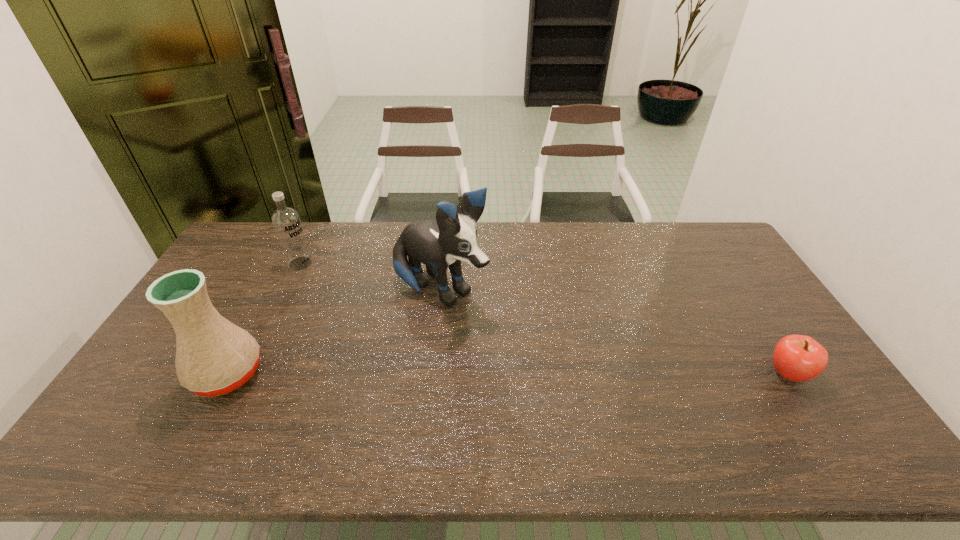
I want to click on object that is at the near right corner, so click(x=798, y=358).

Where is `free space at the far edge`? This screenshot has height=540, width=960. free space at the far edge is located at coordinates click(x=658, y=246).

Where is `free location at the near edge of the desktop`? The height and width of the screenshot is (540, 960). free location at the near edge of the desktop is located at coordinates (439, 420).

Identify the location of vacant point at the left edge. (165, 386).

Identify the location of vacant space at the near left corner. (149, 420).

In the image, there is a desktop. Where is `free space at the near right corner`? free space at the near right corner is located at coordinates (819, 410).

Where is `empty location between the vodka and the rightmost object`? empty location between the vodka and the rightmost object is located at coordinates point(544,319).

At what (x,y) coordinates should I click in order to perform the action: click on free space between the vodka and the third object from left to right. Please return your answer as a coordinate pair (x, y). The image size is (960, 540). Looking at the image, I should click on (371, 277).

Locate an element on the screen. Image resolution: width=960 pixels, height=540 pixels. vacant point located between the shortest object and the tallest object is located at coordinates (614, 332).

Locate an element on the screen. The height and width of the screenshot is (540, 960). vacant space that's between the pottery and the vodka is located at coordinates (264, 319).